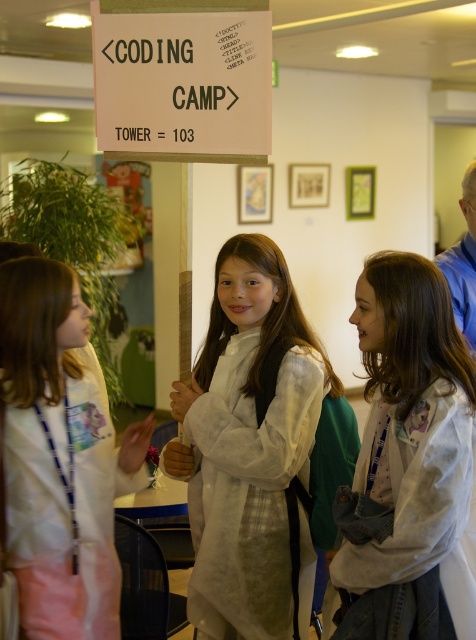
Question: Considering the relative positions of white cotton lab coat at center and white lab coat at left in the image provided, where is white cotton lab coat at center located with respect to white lab coat at left?

Choices:
 (A) above
 (B) below

Answer: (A)

Question: Is white cotton lab coat at center positioned in front of white paper sign at upper center?

Choices:
 (A) yes
 (B) no

Answer: (A)

Question: Which point appears farthest from the camera in this image?

Choices:
 (A) (386, 532)
 (B) (10, 289)
 (C) (239, 570)
 (D) (194, 124)

Answer: (D)

Question: Which point is closer to the camera?

Choices:
 (A) white cotton jacket at center
 (B) white lab coat at left
 (C) white paper sign at upper center
 (D) white cotton lab coat at center

Answer: (A)

Question: Is white cotton jacket at center positioned at the back of white lab coat at left?

Choices:
 (A) yes
 (B) no

Answer: (B)

Question: Which object is farther from the camera taking this photo?

Choices:
 (A) white lab coat at left
 (B) white cotton lab coat at center

Answer: (B)